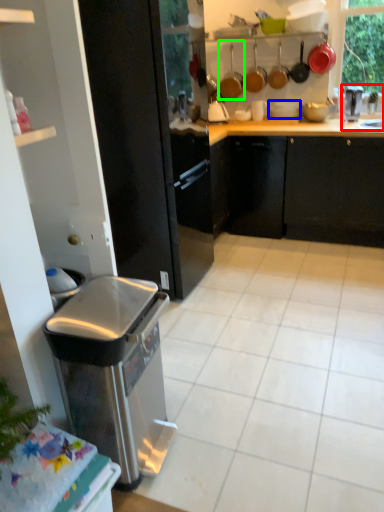
Question: Which is nearer to the sink (highlighted by a red box)? appliance (highlighted by a blue box) or appliance (highlighted by a green box).

Choices:
 (A) appliance
 (B) appliance

Answer: (A)